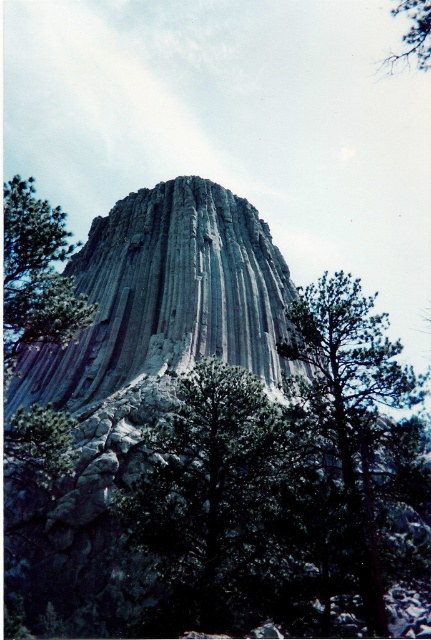
Question: Is green leafy tree at center thinner than green matte tree at lower right?

Choices:
 (A) yes
 (B) no

Answer: (A)

Question: Which is nearer to the green matte tree at lower left?

Choices:
 (A) green matte tree at left
 (B) green matte tree at lower right

Answer: (A)

Question: Is green leafy tree at center positioned behind green matte tree at left?

Choices:
 (A) no
 (B) yes

Answer: (A)

Question: Is green matte tree at left below green matte tree at lower left?

Choices:
 (A) no
 (B) yes

Answer: (A)

Question: Which object appears farthest from the camera in this image?

Choices:
 (A) green leafy tree at upper right
 (B) green leafy tree at center
 (C) green matte tree at left

Answer: (A)

Question: Which point appears closest to the camera in this image?

Choices:
 (A) (65, 468)
 (B) (212, 381)
 (C) (359, 348)

Answer: (C)